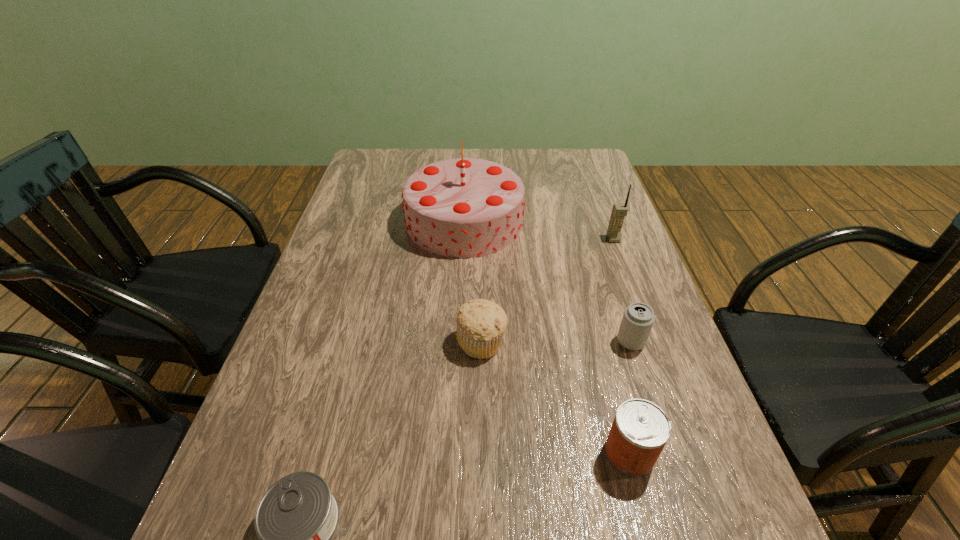
Identify the location of vacant point located between the fifth farthest object and the birthday cake. The height and width of the screenshot is (540, 960). (547, 338).

Image resolution: width=960 pixels, height=540 pixels. I want to click on vacant area between the muffin and the second tallest object, so click(547, 291).

The image size is (960, 540). Find the location of `the fifth closest object to the farthest can`. the fifth closest object to the farthest can is located at coordinates (296, 517).

Identify which object is the third closest to the tallest object. Please provide its 2D coordinates. Your answer should be formatted as a tuple, i.e. [(x, y)], where the tuple contains the x and y coordinates of a point satisfying the conditions above.

[(638, 318)]

Where is `the second closest can to the farthest can`? This screenshot has width=960, height=540. the second closest can to the farthest can is located at coordinates (296, 517).

Find the location of a particular element. The image size is (960, 540). the closest can to the farthest can is located at coordinates (640, 430).